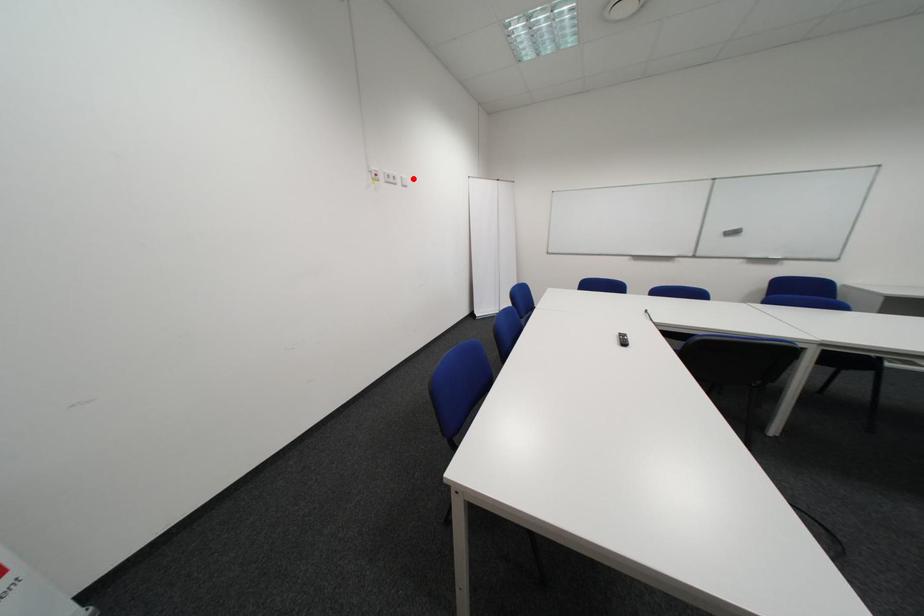
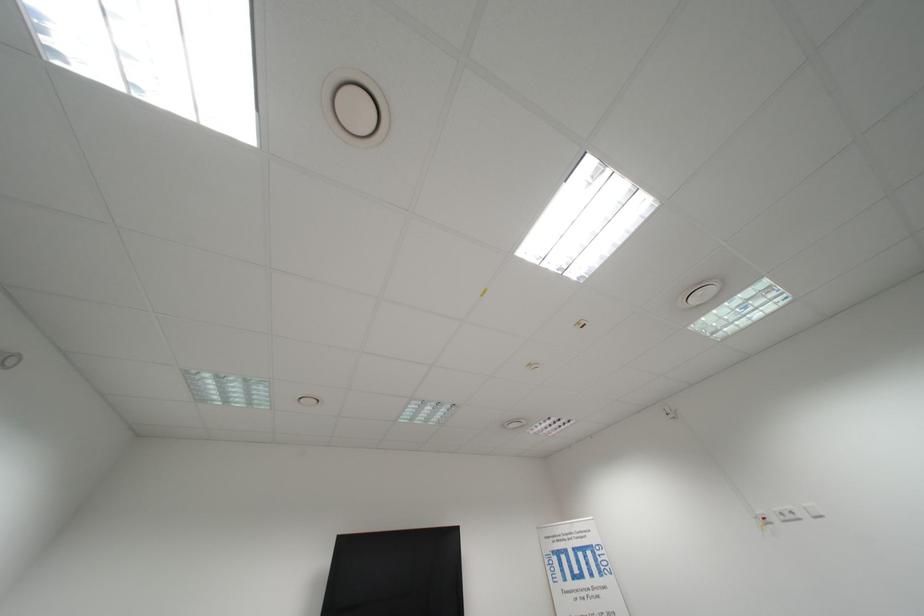
Question: I am providing you with two images of the same scene from different viewpoints. A red point is marked on the first image. At the location where the point appears in image 1, is it still visible in image 2?

Choices:
 (A) Yes
 (B) No

Answer: (A)